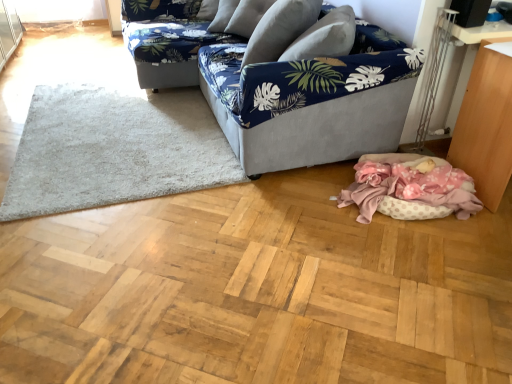
Question: Is wooden table at lower right bigger or smaller than blue floral fabric couch at upper center, the 1th studio couch viewed from the back?

Choices:
 (A) big
 (B) small

Answer: (B)

Question: From the image's perspective, is wooden table at lower right positioned above or below blue floral fabric couch at upper center, the 1th studio couch viewed from the back?

Choices:
 (A) above
 (B) below

Answer: (B)

Question: Which object is the closest to the blue fabric pillow at center?

Choices:
 (A) pink polka dot blanket at lower right
 (B) blue floral fabric couch at upper center, arranged as the second studio couch when viewed from the front
 (C) wooden table at lower right
 (D) navy blue fabric couch at center, which is the 2th studio couch in back-to-front order
 (E) white shaggy rug at lower left

Answer: (D)

Question: Estimate the real-world distances between objects in this image. Which object is closer to the navy blue fabric couch at center, marked as the 1th studio couch in a front-to-back arrangement?

Choices:
 (A) white shaggy rug at lower left
 (B) blue floral fabric couch at upper center, the 1th studio couch viewed from the back
 (C) blue fabric pillow at center
 (D) wooden table at lower right
 (E) pink polka dot blanket at lower right

Answer: (C)